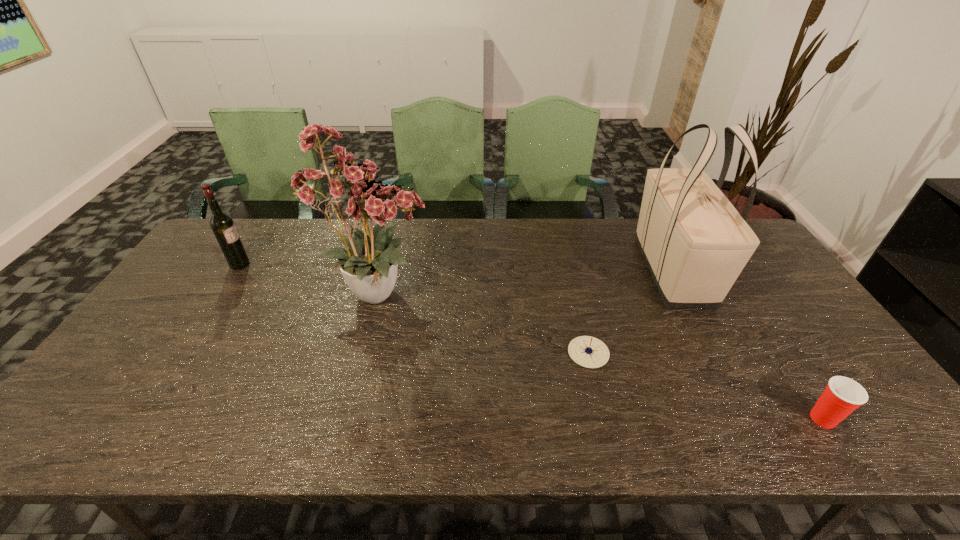
Image resolution: width=960 pixels, height=540 pixels. Find the location of `the second object from left to right`. the second object from left to right is located at coordinates (368, 265).

Find the location of a particular element. The image size is (960, 540). the second object from right to left is located at coordinates (695, 243).

At what (x,y) coordinates should I click in order to perform the action: click on wine bottle. Please return your answer as a coordinate pair (x, y). Looking at the image, I should click on (222, 225).

At what (x,y) coordinates should I click in order to perform the action: click on the third shortest object. Please return your answer as a coordinate pair (x, y). The height and width of the screenshot is (540, 960). Looking at the image, I should click on (222, 225).

You are a GUI agent. You are given a task and a screenshot of the screen. Output one action in this format:
    pyautogui.click(x=<x>, y=<y>)
    Task: Click on the Dixie cup
    
    Given the screenshot: What is the action you would take?
    pyautogui.click(x=842, y=395)

The height and width of the screenshot is (540, 960). What are the coordinates of `the fourth tallest object` in the screenshot? It's located at (842, 395).

Find the location of a particular element. The width and height of the screenshot is (960, 540). the second nearest object is located at coordinates (586, 351).

The height and width of the screenshot is (540, 960). What are the coordinates of `the shortest object` in the screenshot? It's located at (586, 351).

The image size is (960, 540). I want to click on vacant region located on the front-facing side of the flower arrangement, so click(x=523, y=292).

The width and height of the screenshot is (960, 540). In order to click on free region located 0.380m with handles facing forward on the fourth object from left to right in this screenshot , I will do `click(760, 444)`.